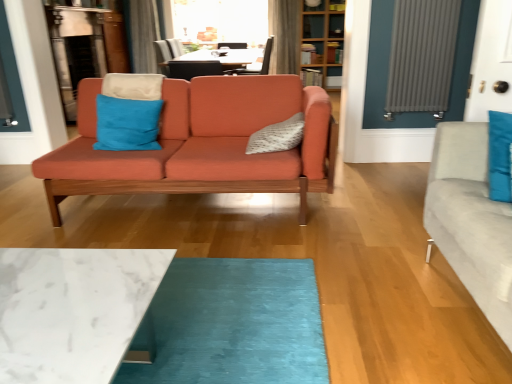
What do you see at coordinates (277, 136) in the screenshot?
I see `textured gray pillow at center, the 1th pillow from the right` at bounding box center [277, 136].

You are a GUI agent. You are given a task and a screenshot of the screen. Output one action in this format:
    pyautogui.click(x=<x>, y=<y>)
    Task: Click on the textured gray pillow at center, positioned as the second pillow in left-to-right order
    This screenshot has height=384, width=512.
    Given the screenshot: What is the action you would take?
    click(x=277, y=136)

What do you see at coordinates (127, 124) in the screenshot? I see `blue suede pillow at center, arranged as the 2th pillow when viewed from the right` at bounding box center [127, 124].

How much space does silky gray curtain at upper center, which is the second curtain in right-to-left order, occupy vertically?

silky gray curtain at upper center, which is the second curtain in right-to-left order, is 1.29 meters in height.

The image size is (512, 384). What do you see at coordinates (261, 65) in the screenshot?
I see `matte black chair at upper center` at bounding box center [261, 65].

Identify the location of transparent glass window screen at upper center. This screenshot has height=384, width=512. (221, 21).

Locate an element on the screen. white marble coffee table at lower center is located at coordinates (73, 310).

At what (x,y) coordinates should I click in order to perform the action: click on textured gray pillow at center, positioned as the second pillow in left-to-right order. Please return your answer as a coordinate pair (x, y). Looking at the image, I should click on (277, 136).

Find the location of `cabinetry that is behind the white marble coffee table at lower center`. cabinetry that is behind the white marble coffee table at lower center is located at coordinates (322, 43).

Based on the photo, is white marble coffee table at lower center at the back of wooden bookshelf at upper center?

No, wooden bookshelf at upper center is not facing away from white marble coffee table at lower center.

Considering the sizes of objects wooden bookshelf at upper center and white marble coffee table at lower center in the image provided, who is thinner, wooden bookshelf at upper center or white marble coffee table at lower center?

With smaller width is wooden bookshelf at upper center.

Is wooden bookshelf at upper center at the right side of white marble coffee table at lower center?

Yes, wooden bookshelf at upper center is to the right of white marble coffee table at lower center.

Who is smaller, textured gray pillow at center, the 1th pillow from the right, or gray ribbed radiator at right?

textured gray pillow at center, the 1th pillow from the right.

Is textured gray pillow at center, positioned as the second pillow in left-to-right order, closer to the viewer compared to gray ribbed radiator at right?

Yes.

Which of these two, textured gray pillow at center, the 1th pillow from the right, or gray ribbed radiator at right, stands taller?

gray ribbed radiator at right is taller.

Is textured gray pillow at center, the 1th pillow from the right, not near gray ribbed radiator at right?

Yes, textured gray pillow at center, the 1th pillow from the right, is far from gray ribbed radiator at right.

From a real-world perspective, who is located lower, textured gray pillow at center, the 1th pillow from the right, or white marble coffee table at lower center?

From a 3D spatial view, white marble coffee table at lower center is below.

Does textured gray pillow at center, the 1th pillow from the right, come in front of white marble coffee table at lower center?

No, textured gray pillow at center, the 1th pillow from the right, is further to the viewer.

What's the angular difference between textured gray pillow at center, the 1th pillow from the right, and white marble coffee table at lower center's facing directions?

The facing directions of textured gray pillow at center, the 1th pillow from the right, and white marble coffee table at lower center are 93.1 degrees apart.

Are textured gray pillow at center, the 1th pillow from the right, and white marble coffee table at lower center making contact?

No, textured gray pillow at center, the 1th pillow from the right, is not with white marble coffee table at lower center.

Can you tell me how much transparent glass window screen at upper center and white marble coffee table at lower center differ in facing direction?

They differ by 179 degrees in their facing directions.

You are a GUI agent. You are given a task and a screenshot of the screen. Output one action in this format:
    pyautogui.click(x=<x>, y=<y>)
    Task: Click on the window screen that is above the white marble coffee table at lower center (from a real-world perspective)
    Image resolution: width=512 pixels, height=384 pixels.
    Given the screenshot: What is the action you would take?
    pyautogui.click(x=221, y=21)

Which of these two, transparent glass window screen at upper center or white marble coffee table at lower center, stands shorter?

Standing shorter between the two is white marble coffee table at lower center.

Does silky gray curtain at upper center, the first curtain viewed from the left, lie in front of transparent glass window screen at upper center?

Yes.

From the image's perspective, which is below, silky gray curtain at upper center, which is the second curtain in right-to-left order, or transparent glass window screen at upper center?

silky gray curtain at upper center, which is the second curtain in right-to-left order, appears lower in the image.

From a real-world perspective, who is located higher, silky gray curtain at upper center, the first curtain viewed from the left, or transparent glass window screen at upper center?

From a 3D spatial view, transparent glass window screen at upper center is above.

Which is closer to the camera, [132,6] or [257,40]?

Point [132,6] is positioned closer to the camera compared to point [257,40].

Locate an element on the screen. pillow below the blue suede pillow at center, the first pillow when ordered from left to right (from a real-world perspective) is located at coordinates (277, 136).

Which is behind, point (126, 115) or point (267, 143)?

The point (126, 115) is behind.

Which object is thinner, blue suede pillow at center, arranged as the 2th pillow when viewed from the right, or textured gray pillow at center, the 1th pillow from the right?

With smaller width is blue suede pillow at center, arranged as the 2th pillow when viewed from the right.

Between silky gray curtain at upper center, which is the second curtain in right-to-left order, and velvet gray curtain at upper center, the first curtain viewed from the right, which one has smaller width?

velvet gray curtain at upper center, the first curtain viewed from the right.

From a real-world perspective, is silky gray curtain at upper center, which is the second curtain in right-to-left order, above or below velvet gray curtain at upper center, arranged as the second curtain when viewed from the left?

Clearly, from a real-world perspective, silky gray curtain at upper center, which is the second curtain in right-to-left order, is above velvet gray curtain at upper center, arranged as the second curtain when viewed from the left.

Is silky gray curtain at upper center, the first curtain viewed from the left, positioned beyond the bounds of velvet gray curtain at upper center, arranged as the second curtain when viewed from the left?

Yes, silky gray curtain at upper center, the first curtain viewed from the left, is outside of velvet gray curtain at upper center, arranged as the second curtain when viewed from the left.

There is a white marble coffee table at lower center. At what (x,y) coordinates should I click in order to perform the action: click on cabinetry above it (from a real-world perspective). Please return your answer as a coordinate pair (x, y). Looking at the image, I should click on (322, 43).

This screenshot has height=384, width=512. In order to click on the 2nd pillow in front when counting from the gray ribbed radiator at right in this screenshot , I will do `click(277, 136)`.

When comparing their distances from gray ribbed radiator at right, does velvet gray curtain at upper center, arranged as the second curtain when viewed from the left, or wooden bookshelf at upper center seem further?

Among the two, velvet gray curtain at upper center, arranged as the second curtain when viewed from the left, is located further to gray ribbed radiator at right.

Looking at the image, which one is located further to velvet gray curtain at upper center, arranged as the second curtain when viewed from the left, wooden bookshelf at upper center or silky gray curtain at upper center, the first curtain viewed from the left?

The object further to velvet gray curtain at upper center, arranged as the second curtain when viewed from the left, is silky gray curtain at upper center, the first curtain viewed from the left.

Considering their positions, is textured gray pillow at center, positioned as the second pillow in left-to-right order, positioned closer to matte orange couch at center than gray ribbed radiator at right?

The object closer to matte orange couch at center is textured gray pillow at center, positioned as the second pillow in left-to-right order.

Based on their spatial positions, is textured gray pillow at center, the 1th pillow from the right, or matte orange couch at center closer to blue suede pillow at center, the first pillow when ordered from left to right?

The object closer to blue suede pillow at center, the first pillow when ordered from left to right, is matte orange couch at center.

Considering their positions, is silky gray curtain at upper center, the first curtain viewed from the left, positioned closer to matte black chair at upper center than textured gray pillow at center, the 1th pillow from the right?

silky gray curtain at upper center, the first curtain viewed from the left.

Estimate the real-world distances between objects in this image. Which object is closer to matte black chair at upper center, matte orange couch at center or white marble coffee table at lower center?

matte orange couch at center is closer to matte black chair at upper center.

Estimate the real-world distances between objects in this image. Which object is closer to matte black chair at upper center, textured gray pillow at center, positioned as the second pillow in left-to-right order, or gray ribbed radiator at right?

Among the two, gray ribbed radiator at right is located nearer to matte black chair at upper center.

Looking at the image, which one is located further to matte orange couch at center, matte black chair at upper center or silky gray curtain at upper center, which is the second curtain in right-to-left order?

matte black chair at upper center.

Identify the location of chair located between blue suede pillow at center, arranged as the 2th pillow when viewed from the right, and transparent glass window screen at upper center in the depth direction. (261, 65).

This screenshot has width=512, height=384. I want to click on chair between silky gray curtain at upper center, the first curtain viewed from the left, and wooden bookshelf at upper center, so click(261, 65).

Image resolution: width=512 pixels, height=384 pixels. I want to click on radiator between textured gray pillow at center, the 1th pillow from the right, and matte black chair at upper center from front to back, so click(422, 56).

Where is `radiator positioned between blue suede pillow at center, arranged as the 2th pillow when viewed from the right, and matte black chair at upper center from near to far`? The width and height of the screenshot is (512, 384). radiator positioned between blue suede pillow at center, arranged as the 2th pillow when viewed from the right, and matte black chair at upper center from near to far is located at coordinates tap(422, 56).